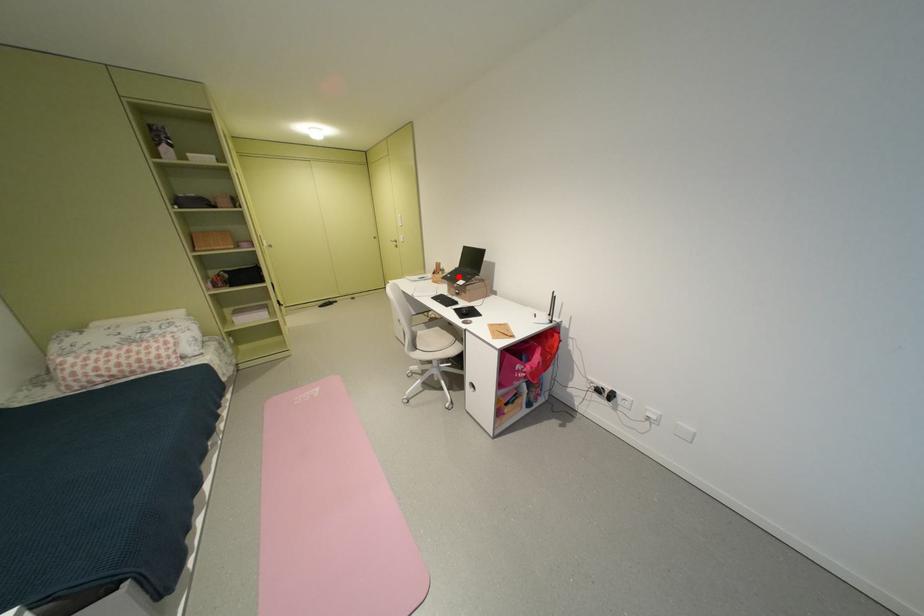
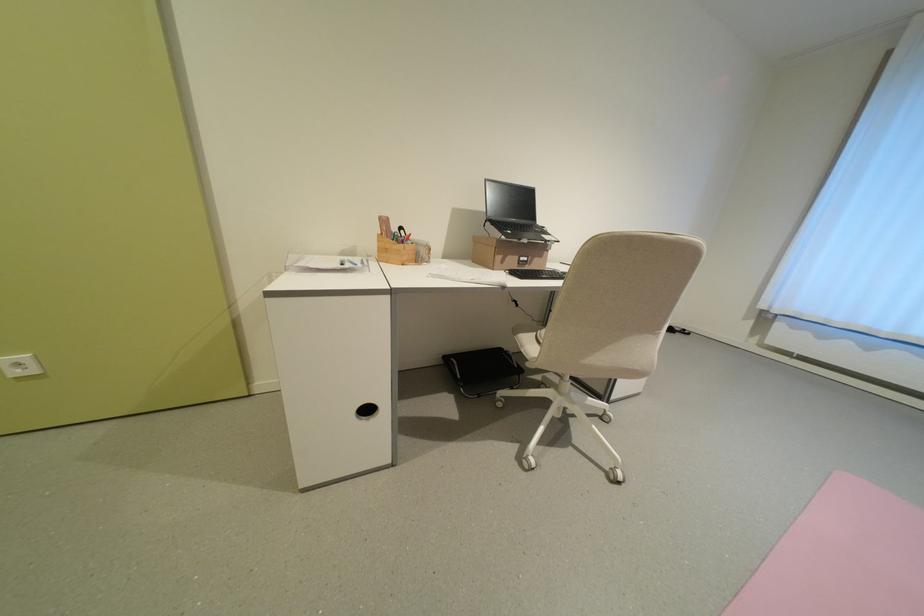
Locate, in the second image, the point that corresponds to the highlighted location in the first image.

(518, 233)